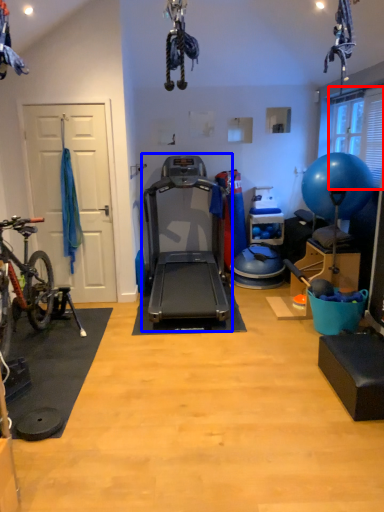
Question: Which of the following is the farthest to the observer, window screen (highlighted by a red box) or treadmill (highlighted by a blue box)?

Choices:
 (A) window screen
 (B) treadmill

Answer: (A)